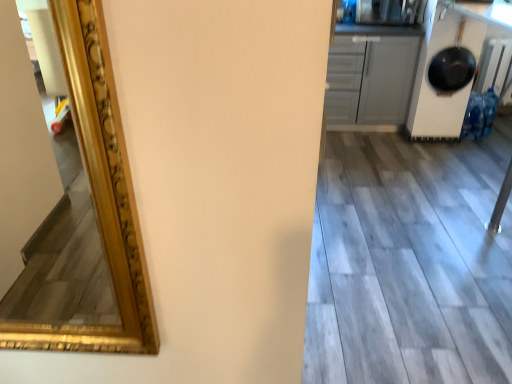
What do you see at coordinates (407, 265) in the screenshot? I see `wooden floor at lower right` at bounding box center [407, 265].

Where is `wooden floor at lower right`? wooden floor at lower right is located at coordinates (407, 265).

What do you see at coordinates (371, 74) in the screenshot?
I see `white matte cabinet at upper right` at bounding box center [371, 74].

This screenshot has height=384, width=512. What are the coordinates of `white matte cabinet at upper right` in the screenshot? It's located at (371, 74).

Identify the location of wooden floor at lower right. (407, 265).

Considering the relative positions of white matte cabinet at upper right and wooden floor at lower right in the image provided, is white matte cabinet at upper right to the left of wooden floor at lower right from the viewer's perspective?

Yes, white matte cabinet at upper right is to the left of wooden floor at lower right.

Which object is closer to the camera, white matte cabinet at upper right or wooden floor at lower right?

Positioned in front is wooden floor at lower right.

Looking at this image, which point is more distant from viewer, (415,38) or (385,329)?

The point (415,38) is farther.

From the image's perspective, who appears lower, white matte cabinet at upper right or wooden floor at lower right?

From the image's view, wooden floor at lower right is below.

From a real-world perspective, which object rests below the other?

wooden floor at lower right is physically lower.

Considering the sizes of objects white matte cabinet at upper right and wooden floor at lower right in the image provided, who is thinner, white matte cabinet at upper right or wooden floor at lower right?

white matte cabinet at upper right is thinner.

In terms of height, does white matte cabinet at upper right look taller or shorter compared to wooden floor at lower right?

Clearly, white matte cabinet at upper right is taller compared to wooden floor at lower right.

Does white matte cabinet at upper right have a smaller size compared to wooden floor at lower right?

No.

Is white matte cabinet at upper right surrounding wooden floor at lower right?

No, wooden floor at lower right is not inside white matte cabinet at upper right.

Are white matte cabinet at upper right and wooden floor at lower right located far from each other?

They are positioned close to each other.

From the picture: Does white matte cabinet at upper right turn towards wooden floor at lower right?

Yes, white matte cabinet at upper right is oriented towards wooden floor at lower right.

Where is `cabinetry behind the wooden floor at lower right`? cabinetry behind the wooden floor at lower right is located at coordinates (371, 74).

In the scene shown: Between wooden floor at lower right and white matte cabinet at upper right, which one appears on the right side from the viewer's perspective?

From the viewer's perspective, wooden floor at lower right appears more on the right side.

Relative to white matte cabinet at upper right, is wooden floor at lower right in front or behind?

wooden floor at lower right is in front of white matte cabinet at upper right.

Between point (350, 350) and point (355, 39), which one is positioned behind?

The point (355, 39) is farther from the camera.

From the image's perspective, between wooden floor at lower right and white matte cabinet at upper right, which one is located above?

white matte cabinet at upper right.

From a real-world perspective, is wooden floor at lower right over white matte cabinet at upper right?

No, from a real-world perspective, wooden floor at lower right is not over white matte cabinet at upper right

Is wooden floor at lower right thinner than white matte cabinet at upper right?

In fact, wooden floor at lower right might be wider than white matte cabinet at upper right.

Is wooden floor at lower right shorter than white matte cabinet at upper right?

Correct, wooden floor at lower right is not as tall as white matte cabinet at upper right.

Looking at the image, does wooden floor at lower right seem bigger or smaller compared to white matte cabinet at upper right?

In the image, wooden floor at lower right appears to be smaller than white matte cabinet at upper right.

Consider the image. Is wooden floor at lower right spatially inside white matte cabinet at upper right, or outside of it?

wooden floor at lower right lies outside white matte cabinet at upper right.

Is wooden floor at lower right in contact with white matte cabinet at upper right?

No, wooden floor at lower right is not in contact with white matte cabinet at upper right.

Could you tell me if wooden floor at lower right is facing white matte cabinet at upper right?

No, wooden floor at lower right is not facing towards white matte cabinet at upper right.

How many degrees apart are the facing directions of wooden floor at lower right and white matte cabinet at upper right?

The angle between the facing direction of wooden floor at lower right and the facing direction of white matte cabinet at upper right is 0.338 degrees.

Image resolution: width=512 pixels, height=384 pixels. Find the location of `tile located in front of the white matte cabinet at upper right`. tile located in front of the white matte cabinet at upper right is located at coordinates (407, 265).

The width and height of the screenshot is (512, 384). Identify the location of tile below the white matte cabinet at upper right (from the image's perspective). (407, 265).

Locate an element on the screen. The image size is (512, 384). cabinetry located above the wooden floor at lower right (from the image's perspective) is located at coordinates (371, 74).